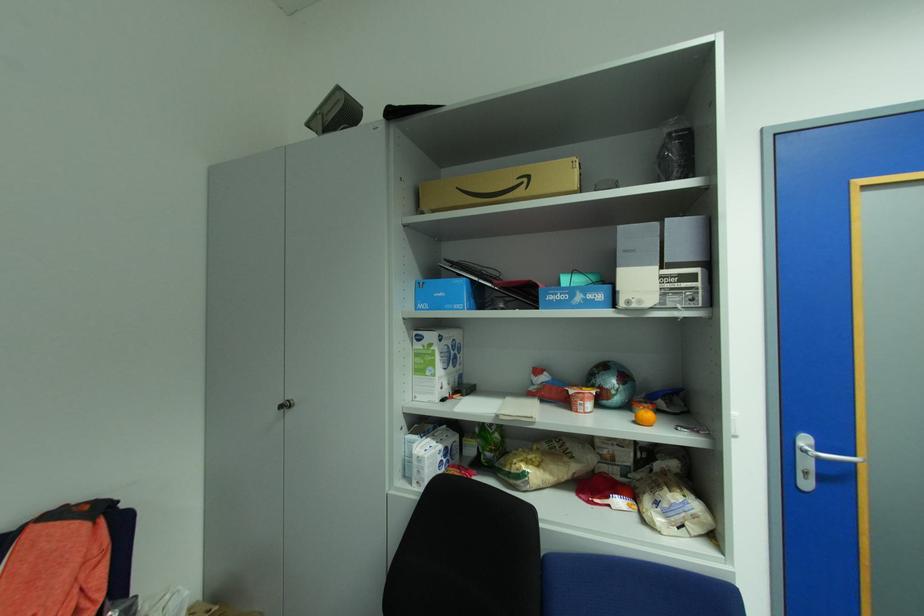
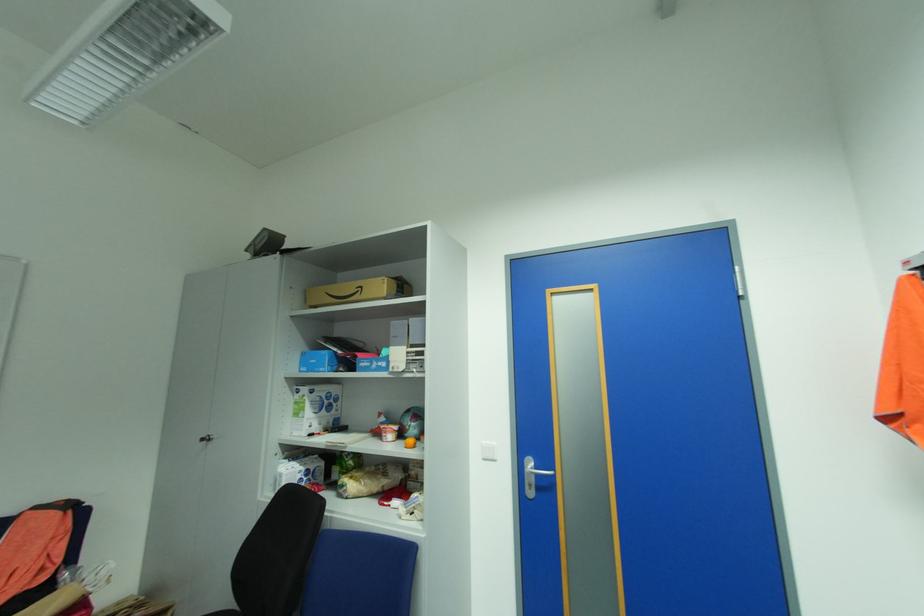
The point at (293, 406) is marked in the first image. Where is the corresponding point in the second image?

(213, 439)